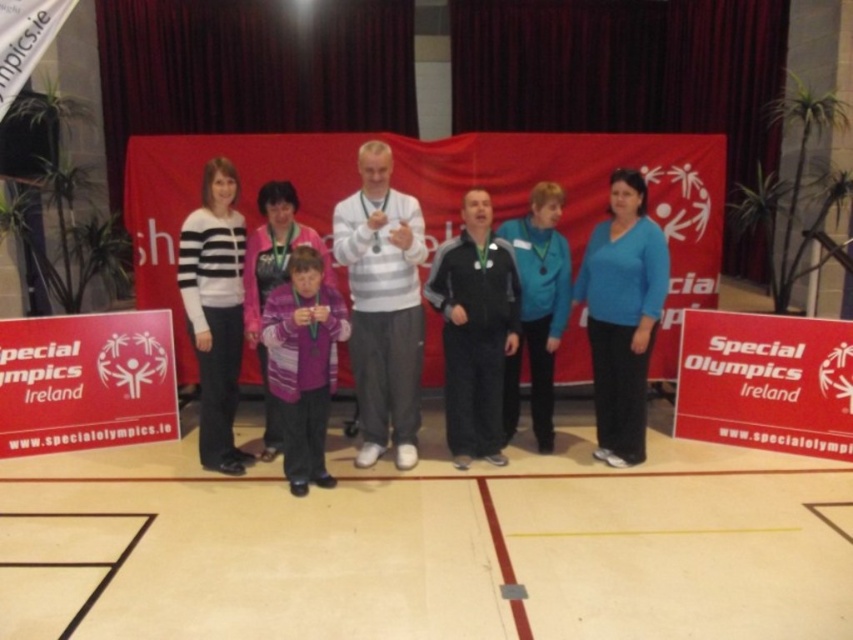
Does blue matte sweater at center appear under purple knitwear at center?

Incorrect, blue matte sweater at center is not positioned below purple knitwear at center.

Which is below, blue matte sweater at center or purple knitwear at center?

Positioned lower is purple knitwear at center.

The image size is (853, 640). In order to click on blue matte sweater at center in this screenshot , I will do `click(622, 316)`.

The width and height of the screenshot is (853, 640). I want to click on blue matte sweater at center, so (622, 316).

Measure the distance between gray cotton sweater at center and white striped sweater at center.

They are 30.88 inches apart.

Can you confirm if gray cotton sweater at center is bigger than white striped sweater at center?

Yes.

Which is behind, point (395, 280) or point (213, 419)?

The point (213, 419) is behind.

The height and width of the screenshot is (640, 853). In order to click on gray cotton sweater at center in this screenshot , I will do `click(381, 305)`.

How far apart are blue matte sweater at center and black matte jacket at center?

blue matte sweater at center and black matte jacket at center are 66.41 centimeters apart.

Find the location of a particular element. The width and height of the screenshot is (853, 640). blue matte sweater at center is located at coordinates (622, 316).